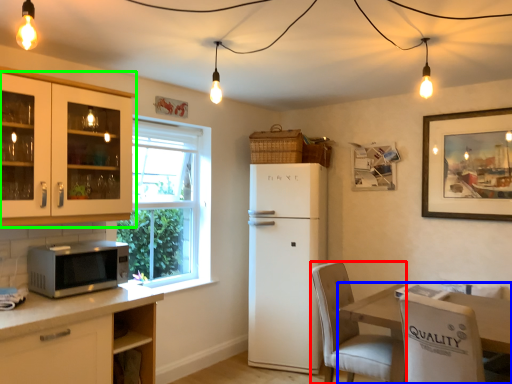
Question: Which object is positioned farthest from chair (highlighted by a red box)? Select from table (highlighted by a blue box) and cabinetry (highlighted by a green box).

Choices:
 (A) table
 (B) cabinetry

Answer: (B)